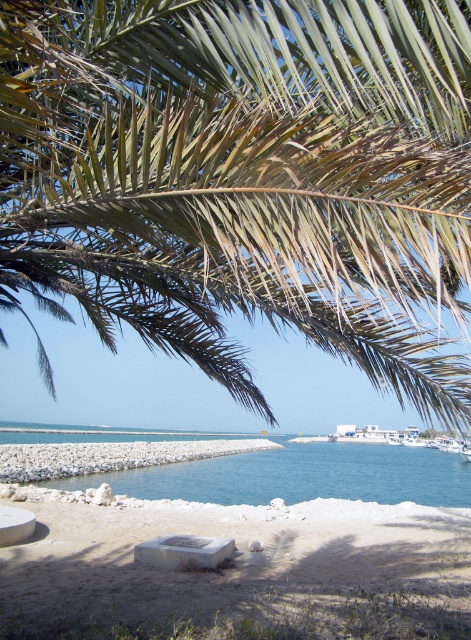
You are standing at point (x=245, y=180) in the coastal scene. What object is located exactly at your current position?

The green leafy palm tree at upper center is located exactly at point (x=245, y=180).

You are a beachgoer trying to set up a sun umbrella. You want to place it where there is more space. Between the white sand at lower center and the blue water at center, which area should you choose?

The blue water at center occupies more space than the white sand at lower center, so you should choose the blue water at center for setting up the sun umbrella.

You are a photographer planning to capture the green leafy palm tree at upper center and the white sand at lower center in a single frame. Based on their sizes, which object would occupy more space in the photo?

The green leafy palm tree at upper center would occupy more space in the photo since its width is larger than the white sand at lower center.